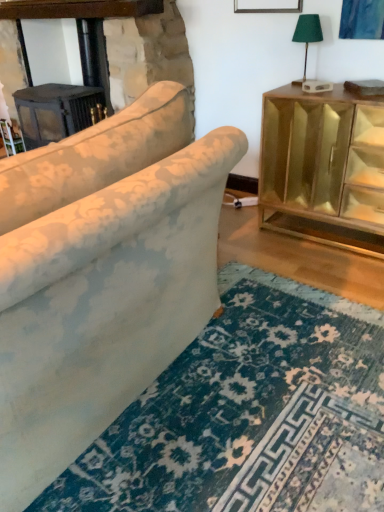
Locate an element on the screen. This screenshot has width=384, height=512. free space to the left of gold mirrored cabinet at right is located at coordinates (257, 237).